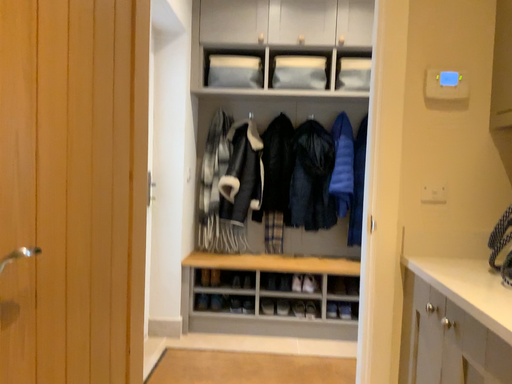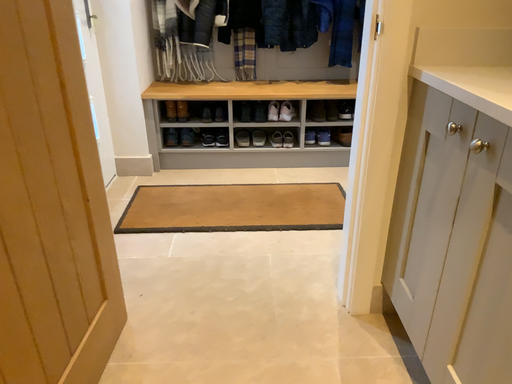
Question: Which way did the camera rotate in the video?

Choices:
 (A) rotated upward
 (B) rotated downward

Answer: (B)